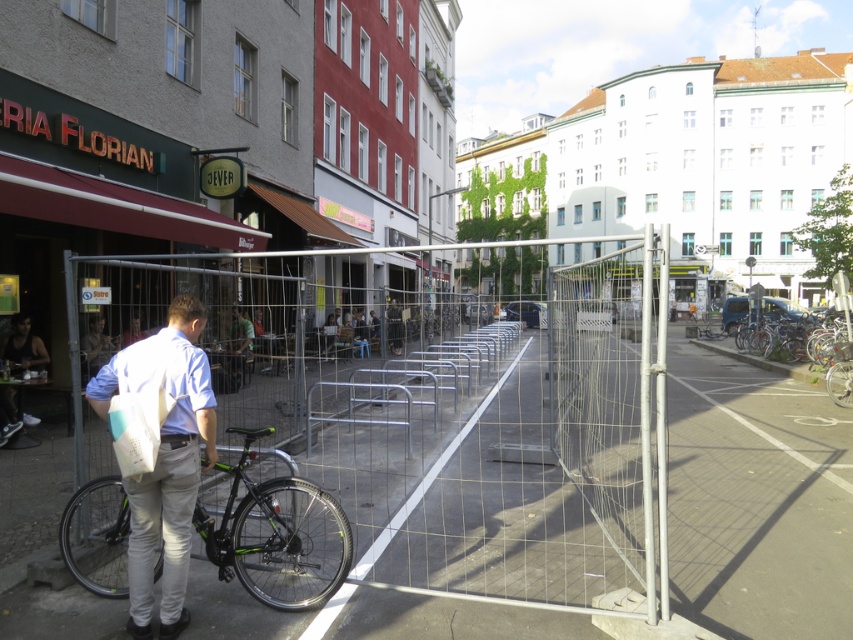
In the scene shown: You are a delivery person trying to see the shiny metallic bicycle at right parked behind the wire mesh fence at center. Can you see the entire bicycle without moving closer?

The wire mesh fence at center is taller than the shiny metallic bicycle at right, so you cannot see the entire bicycle without moving closer.

You are a fashion designer observing jackets in an urban setting. You notice a dark brown leather jacket at lower left and a matte black jacket at center. Which jacket would you recommend to a client seeking a more prominent style statement?

The dark brown leather jacket at lower left is larger in size than the matte black jacket at center, making it a more eye catching option for a bold style statement.

You are standing at the center of the urban street scene, and you want to walk towards the wire mesh fence at center. In which direction should you move?

Since the wire mesh fence at center is located at point (440, 442), you should move towards the center of the image to reach it.